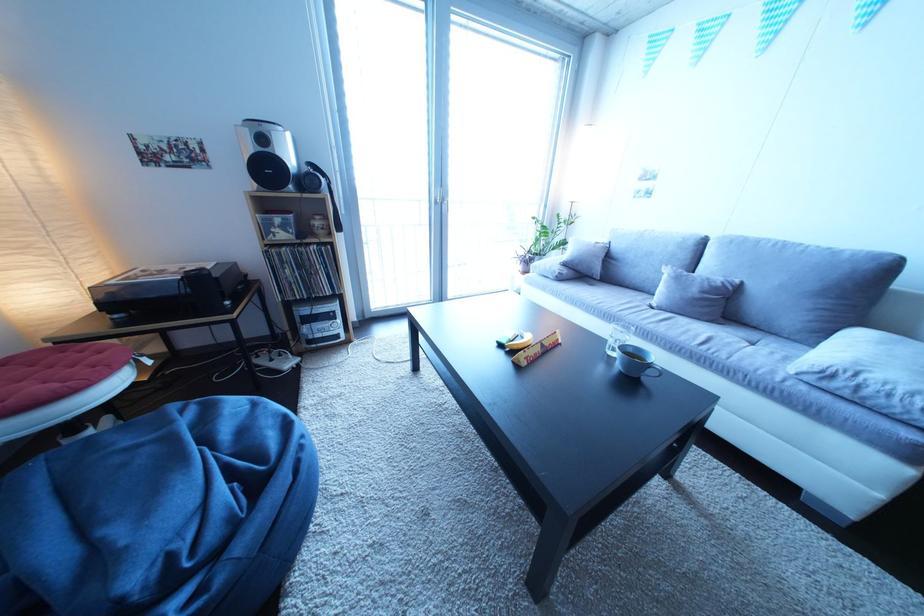
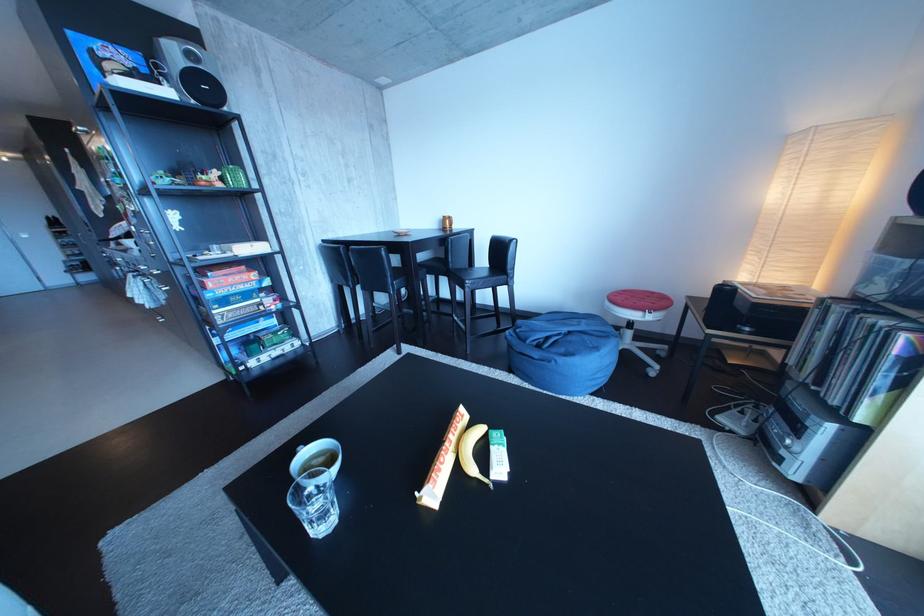
Locate, in the second image, the point that corresponds to [285,366] in the first image.

(755, 419)